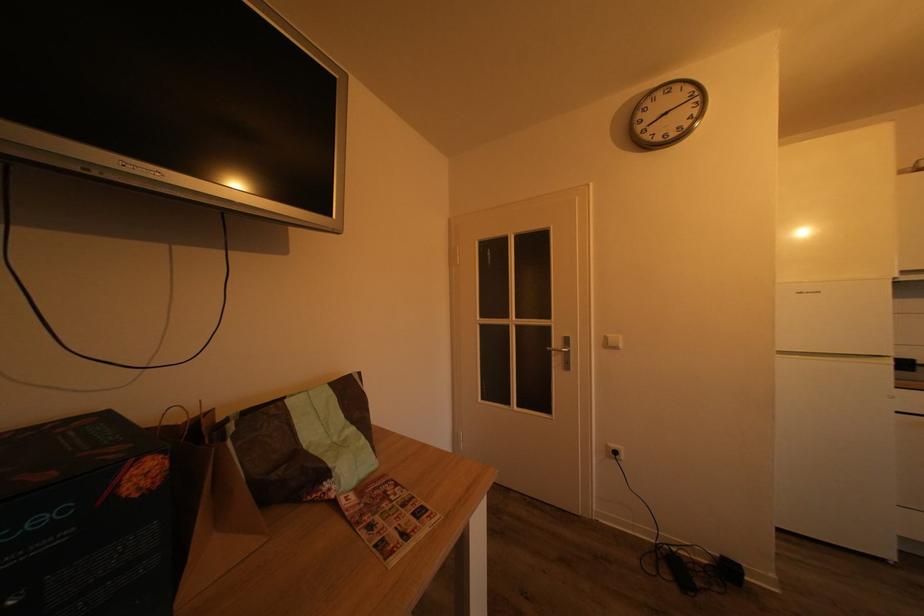
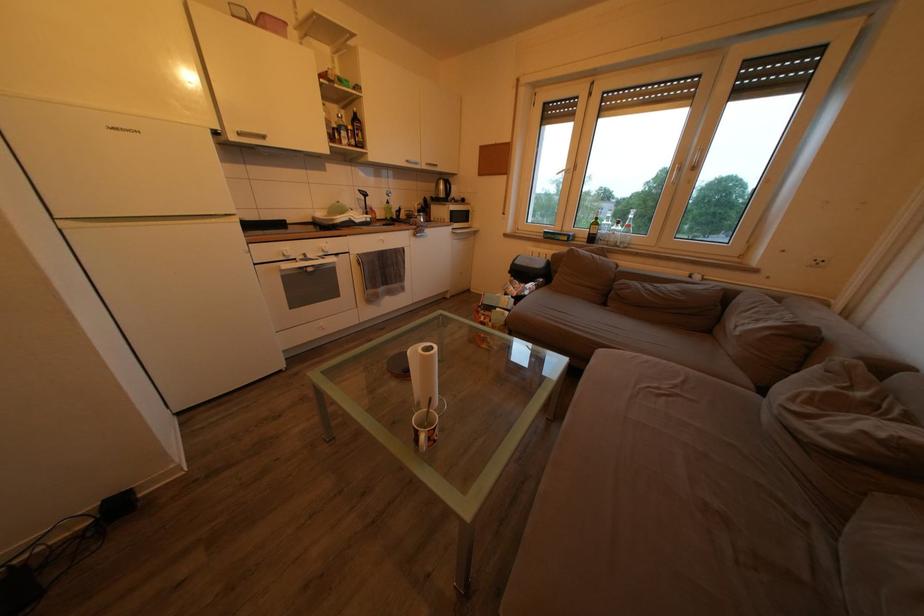
The first image is from the beginning of the video and the second image is from the end. How did the camera likely rotate when shooting the video?

The camera's rotation is toward right-down.